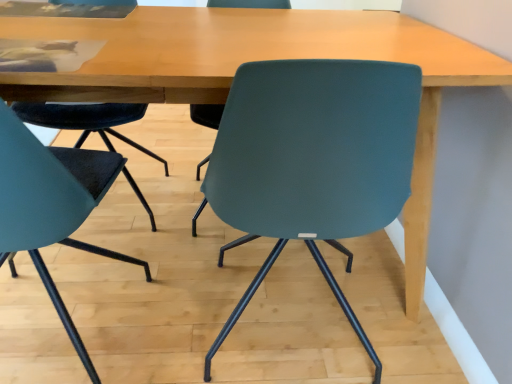
Describe the element at coordinates (313, 160) in the screenshot. Image resolution: width=512 pixels, height=384 pixels. I see `teal matte chair at center, which is the 2th chair from left to right` at that location.

Find the location of a particular element. The height and width of the screenshot is (384, 512). teal matte chair at center, which is the 2th chair from left to right is located at coordinates (313, 160).

Describe the element at coordinates (51, 204) in the screenshot. The width and height of the screenshot is (512, 384). I see `teal matte chair at left, positioned as the first chair in left-to-right order` at that location.

Find the location of a particular element. The width and height of the screenshot is (512, 384). teal matte chair at left, the 2th chair viewed from the right is located at coordinates (51, 204).

In order to click on teal matte chair at center, the 1th chair when ordered from right to left in this screenshot , I will do `click(313, 160)`.

Does teal matte chair at left, the 2th chair viewed from the right, appear on the right side of teal matte chair at center, which is the 2th chair from left to right?

In fact, teal matte chair at left, the 2th chair viewed from the right, is to the left of teal matte chair at center, which is the 2th chair from left to right.

Which object is closer to the camera, teal matte chair at left, positioned as the first chair in left-to-right order, or teal matte chair at center, which is the 2th chair from left to right?

teal matte chair at left, positioned as the first chair in left-to-right order, is in front.

Between point (47, 288) and point (272, 179), which one is positioned in front?

The point (272, 179) is more forward.

From the image's perspective, which is below, teal matte chair at left, the 2th chair viewed from the right, or teal matte chair at center, the 1th chair when ordered from right to left?

→ teal matte chair at left, the 2th chair viewed from the right, is shown below in the image.

From a real-world perspective, is teal matte chair at left, the 2th chair viewed from the right, beneath teal matte chair at center, which is the 2th chair from left to right?

No, from a real-world perspective, teal matte chair at left, the 2th chair viewed from the right, is not beneath teal matte chair at center, which is the 2th chair from left to right.

Which object is wider, teal matte chair at left, the 2th chair viewed from the right, or teal matte chair at center, the 1th chair when ordered from right to left?

teal matte chair at center, the 1th chair when ordered from right to left.

Is teal matte chair at left, the 2th chair viewed from the right, taller or shorter than teal matte chair at center, which is the 2th chair from left to right?

teal matte chair at left, the 2th chair viewed from the right, is taller than teal matte chair at center, which is the 2th chair from left to right.

Between teal matte chair at left, the 2th chair viewed from the right, and teal matte chair at center, the 1th chair when ordered from right to left, which one has larger size?

teal matte chair at center, the 1th chair when ordered from right to left.

Can teal matte chair at center, which is the 2th chair from left to right, be found inside teal matte chair at left, the 2th chair viewed from the right?

That's incorrect, teal matte chair at center, which is the 2th chair from left to right, is not inside teal matte chair at left, the 2th chair viewed from the right.

Are teal matte chair at left, positioned as the first chair in left-to-right order, and teal matte chair at center, which is the 2th chair from left to right, located far from each other?

No.

Is teal matte chair at left, the 2th chair viewed from the right, oriented towards teal matte chair at center, the 1th chair when ordered from right to left?

No, teal matte chair at left, the 2th chair viewed from the right, is not oriented towards teal matte chair at center, the 1th chair when ordered from right to left.

Can you tell me how much teal matte chair at left, the 2th chair viewed from the right, and teal matte chair at center, the 1th chair when ordered from right to left, differ in facing direction?

The facing directions of teal matte chair at left, the 2th chair viewed from the right, and teal matte chair at center, the 1th chair when ordered from right to left, are 0.941 degrees apart.

Where is `chair located above the teal matte chair at left, the 2th chair viewed from the right (from the image's perspective)`? The image size is (512, 384). chair located above the teal matte chair at left, the 2th chair viewed from the right (from the image's perspective) is located at coordinates (313, 160).

Consider the image. Considering the positions of objects teal matte chair at center, the 1th chair when ordered from right to left, and teal matte chair at left, positioned as the first chair in left-to-right order, in the image provided, who is more to the right, teal matte chair at center, the 1th chair when ordered from right to left, or teal matte chair at left, positioned as the first chair in left-to-right order,?

teal matte chair at center, the 1th chair when ordered from right to left, is more to the right.

Between teal matte chair at center, which is the 2th chair from left to right, and teal matte chair at left, the 2th chair viewed from the right, which one is positioned in front?

teal matte chair at left, the 2th chair viewed from the right, is closer to the camera.

Does point (274, 221) come behind point (24, 175)?

Yes, point (274, 221) is behind point (24, 175).

From the image's perspective, is teal matte chair at center, which is the 2th chair from left to right, over teal matte chair at left, the 2th chair viewed from the right?

Yes.

From a real-world perspective, who is located higher, teal matte chair at center, the 1th chair when ordered from right to left, or teal matte chair at left, the 2th chair viewed from the right?

teal matte chair at left, the 2th chair viewed from the right.

Does teal matte chair at center, which is the 2th chair from left to right, have a lesser width compared to teal matte chair at left, positioned as the first chair in left-to-right order?

Incorrect, the width of teal matte chair at center, which is the 2th chair from left to right, is not less than that of teal matte chair at left, positioned as the first chair in left-to-right order.

Considering the sizes of objects teal matte chair at center, the 1th chair when ordered from right to left, and teal matte chair at left, the 2th chair viewed from the right, in the image provided, who is shorter, teal matte chair at center, the 1th chair when ordered from right to left, or teal matte chair at left, the 2th chair viewed from the right,?

Standing shorter between the two is teal matte chair at center, the 1th chair when ordered from right to left.

Between teal matte chair at center, the 1th chair when ordered from right to left, and teal matte chair at left, the 2th chair viewed from the right, which one has smaller size?

teal matte chair at left, the 2th chair viewed from the right, is smaller.

Is teal matte chair at center, which is the 2th chair from left to right, located outside teal matte chair at left, positioned as the first chair in left-to-right order?

teal matte chair at center, which is the 2th chair from left to right, is positioned outside teal matte chair at left, positioned as the first chair in left-to-right order.

Is teal matte chair at center, which is the 2th chair from left to right, far away from teal matte chair at left, the 2th chair viewed from the right?

No, there isn't a large distance between teal matte chair at center, which is the 2th chair from left to right, and teal matte chair at left, the 2th chair viewed from the right.

Is teal matte chair at center, the 1th chair when ordered from right to left, turned away from teal matte chair at left, the 2th chair viewed from the right?

That's not correct — teal matte chair at center, the 1th chair when ordered from right to left, is not looking away from teal matte chair at left, the 2th chair viewed from the right.

Can you tell me how much teal matte chair at center, which is the 2th chair from left to right, and teal matte chair at left, positioned as the first chair in left-to-right order, differ in facing direction?

0.941 degrees separate the facing orientations of teal matte chair at center, which is the 2th chair from left to right, and teal matte chair at left, positioned as the first chair in left-to-right order.

How much distance is there between teal matte chair at center, the 1th chair when ordered from right to left, and teal matte chair at left, positioned as the first chair in left-to-right order?

teal matte chair at center, the 1th chair when ordered from right to left, and teal matte chair at left, positioned as the first chair in left-to-right order, are 16.93 inches apart from each other.

Identify the location of chair that is below the teal matte chair at center, the 1th chair when ordered from right to left (from the image's perspective). The width and height of the screenshot is (512, 384). (51, 204).

Image resolution: width=512 pixels, height=384 pixels. Identify the location of chair located on the right of teal matte chair at left, the 2th chair viewed from the right. (313, 160).

Locate an element on the screen. The height and width of the screenshot is (384, 512). chair lying behind the teal matte chair at left, positioned as the first chair in left-to-right order is located at coordinates (313, 160).